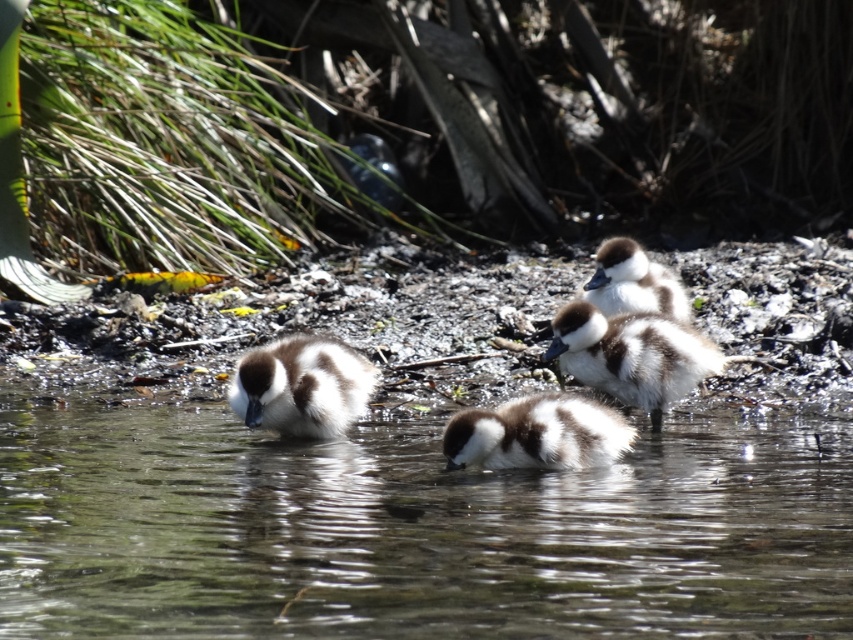
You are a nature photographer observing the ducklings. You want to capture a photo where both the brown speckled duckling at center and the brown fluffy duckling at upper right are visible. Based on their positions, which duckling is positioned lower in the image?

The brown speckled duckling at center is located below the brown fluffy duckling at upper right, so the brown speckled duckling at center is positioned lower in the image.

You are observing the scene and need to determine the position of the translucent water at center. Based on the coordinates provided, can you confirm if it is positioned towards the upper or lower half of the image?

The translucent water at center is located at coordinates point (413, 531). Since the y coordinate 0.485 is less than 0.5, it is positioned in the lower half of the image.

You are a small toy boat that is 10 inches long. You are placed in the translucent water at center and want to reach the brown and white fluffy duckling at center. Can you navigate directly to the duckling without any obstacles?

The distance between the translucent water at center and the brown and white fluffy duckling at center is 17.64 inches. Since the boat is 10 inches long, it can navigate the 17.64 inches distance to reach the duckling as there are no mentioned obstacles in the scene.